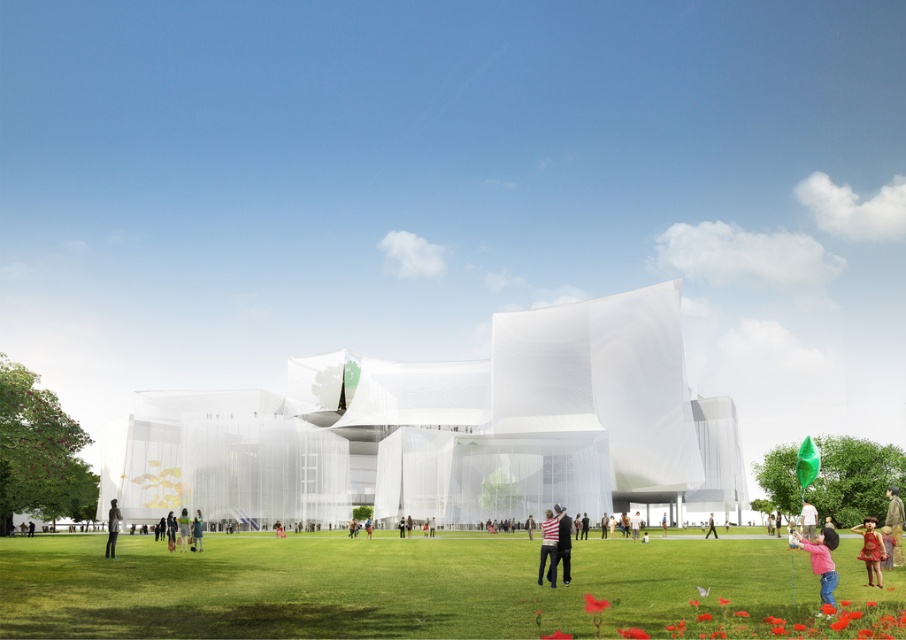
Question: Where is striped fabric shirt at center located in relation to red dress at lower right in the image?

Choices:
 (A) below
 (B) above

Answer: (A)

Question: Which point appears farthest from the camera in this image?

Choices:
 (A) (831, 576)
 (B) (860, 557)
 (C) (108, 552)

Answer: (C)

Question: Is matte red dress at lower right behind striped fabric shirt at center?

Choices:
 (A) yes
 (B) no

Answer: (B)

Question: Estimate the real-world distances between objects in this image. Which object is farther from the light brown fabric at center?

Choices:
 (A) pink fabric balloon at lower right
 (B) matte black jacket at lower center

Answer: (A)

Question: Which object appears farthest from the camera in this image?

Choices:
 (A) red dress at lower right
 (B) light brown leather jacket at center
 (C) striped fabric at center

Answer: (B)

Question: Can you confirm if striped fabric shirt at center is positioned above red dress at lower right?

Choices:
 (A) no
 (B) yes

Answer: (A)